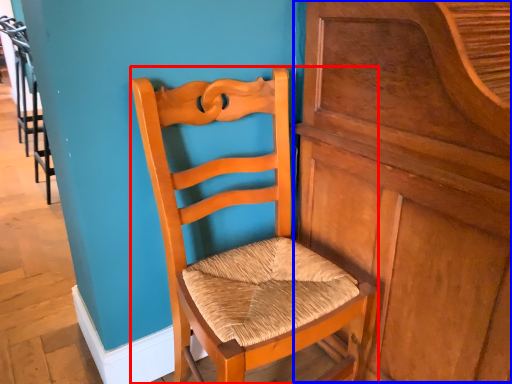
Question: Which of the following is the closest to the observer, chair (highlighted by a red box) or dresser (highlighted by a blue box)?

Choices:
 (A) chair
 (B) dresser

Answer: (B)